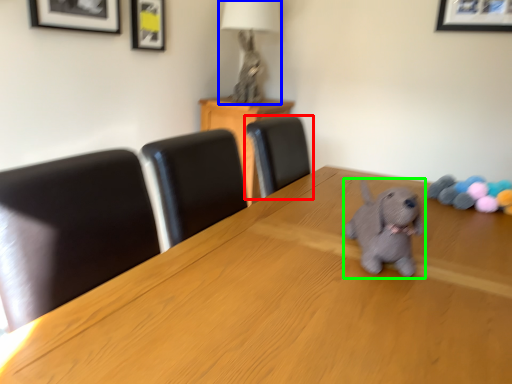
Question: Which object is positioned closest to chair (highlighted by a red box)? Select from table lamp (highlighted by a blue box) and dog (highlighted by a green box).

Choices:
 (A) table lamp
 (B) dog

Answer: (B)